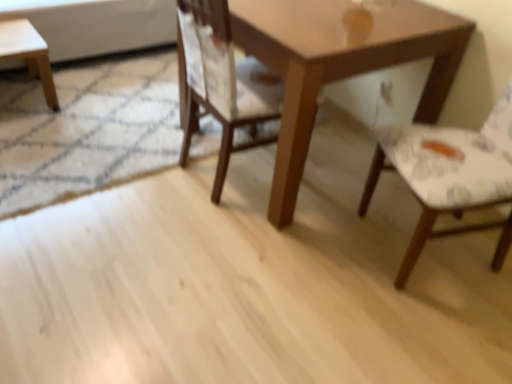
Find the location of a particular element. This screenshot has width=512, height=384. free space in front of wooden chair at center, acting as the second chair starting from the right is located at coordinates 254,241.